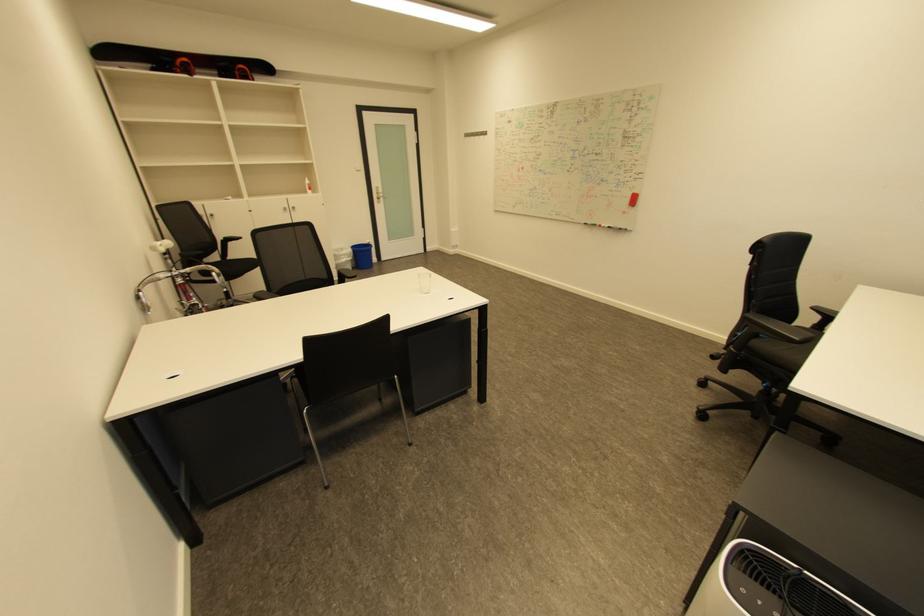
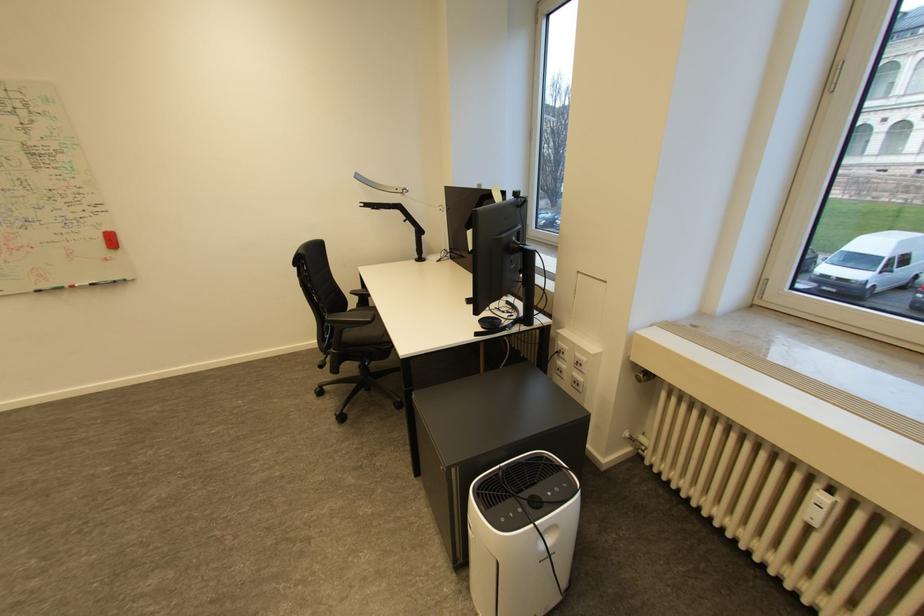
Locate, in the second image, the point that corresponds to (x=800, y=325) in the first image.

(355, 310)